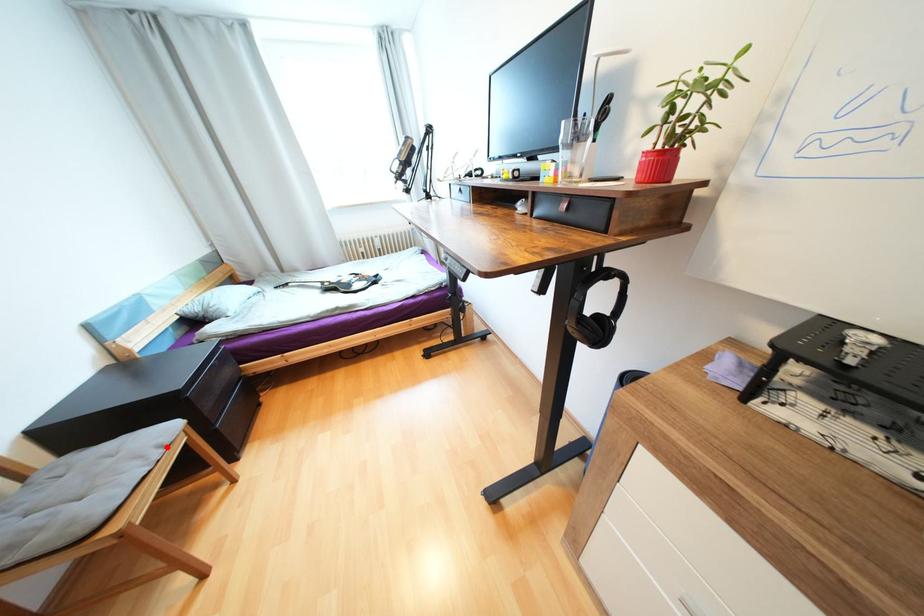
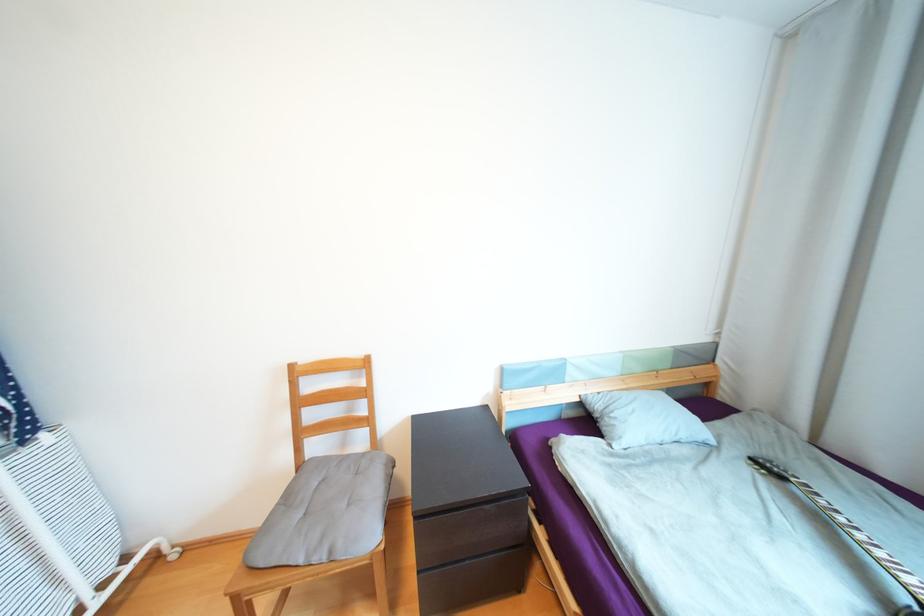
Where in the second image is the point corresponding to the highlighted location from the first image?

(335, 553)